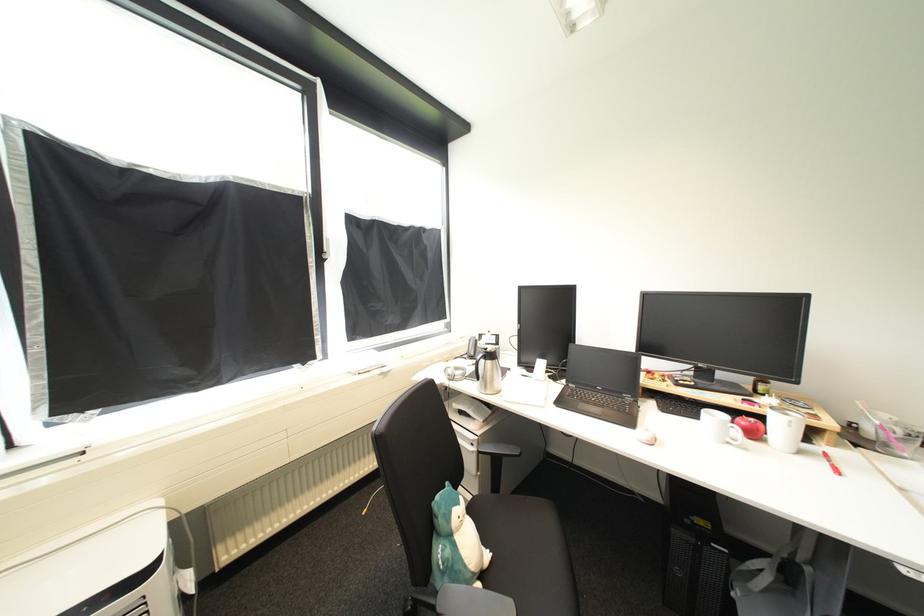
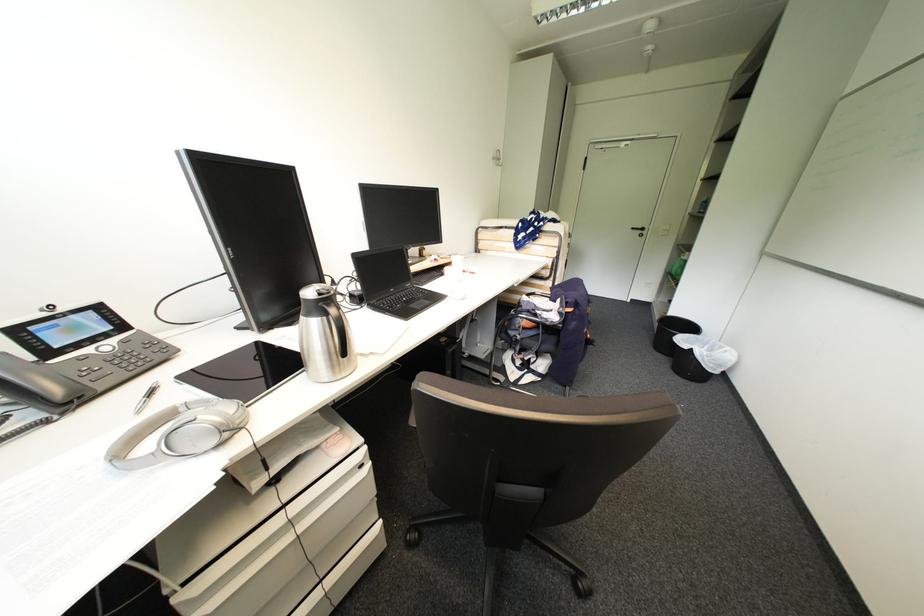
Question: I am providing you with two images of the same scene from different viewpoints. Which of the following objects are not visible in image2?

Choices:
 (A) white door handle
 (B) white cleaner bottle
 (C) blue plush toy
 (D) drawer handle recess

Answer: (C)